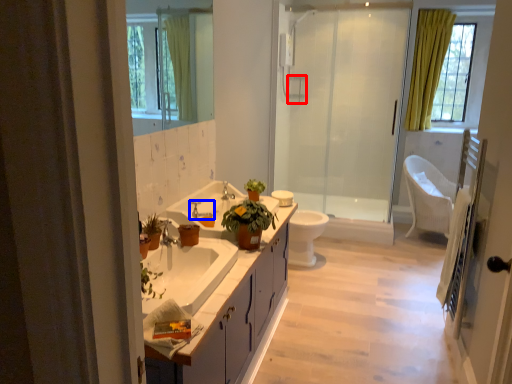
Question: Which of the following is the closest to the observer, towel bar (highlighted by a red box) or tap (highlighted by a blue box)?

Choices:
 (A) towel bar
 (B) tap

Answer: (B)